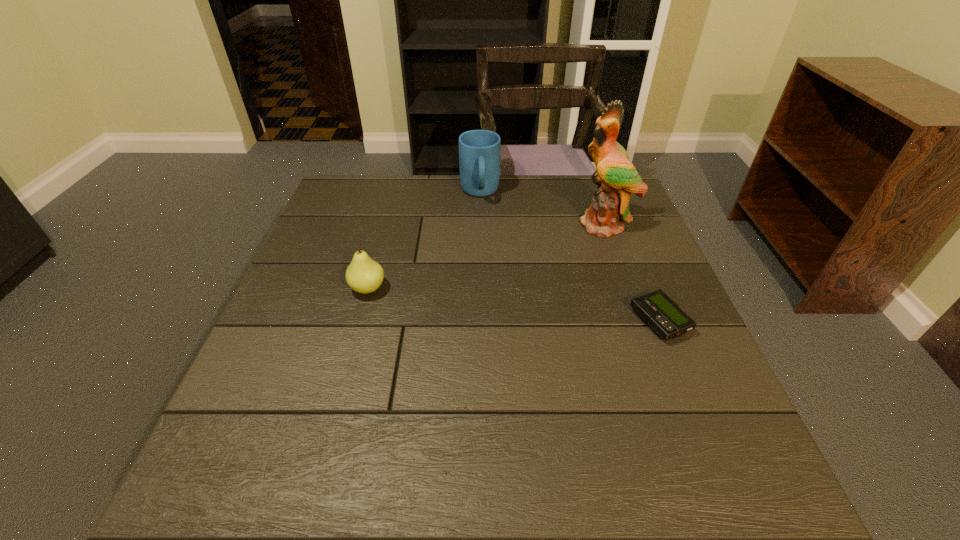
Where is `object situated at the far right corner`? object situated at the far right corner is located at coordinates (616, 177).

This screenshot has height=540, width=960. In order to click on vacant space at the far edge of the desktop in this screenshot , I will do `click(402, 193)`.

In the image, there is a desktop. Where is `vacant region at the near edge`? vacant region at the near edge is located at coordinates (429, 431).

You are a GUI agent. You are given a task and a screenshot of the screen. Output one action in this format:
    pyautogui.click(x=<x>, y=<y>)
    Task: Click on the blank space at the left edge of the desktop
    
    Given the screenshot: What is the action you would take?
    pyautogui.click(x=331, y=301)

This screenshot has height=540, width=960. Identify the location of free region at the right edge of the desktop. (599, 241).

What are the coordinates of `vacant space at the near right corner of the desktop` in the screenshot? It's located at (655, 421).

The image size is (960, 540). I want to click on free area in between the tallest object and the third tallest object, so click(x=487, y=256).

Locate an element on the screen. The width and height of the screenshot is (960, 540). unoccupied area between the second tallest object and the shortest object is located at coordinates (569, 257).

You are a GUI agent. You are given a task and a screenshot of the screen. Output one action in this format:
    pyautogui.click(x=<x>, y=<y>)
    Task: Click on the free spot between the parrot and the shortest object
    This screenshot has width=960, height=540.
    Given the screenshot: What is the action you would take?
    pyautogui.click(x=633, y=273)

Identify the location of vacant area between the third tallest object and the shortest object. The width and height of the screenshot is (960, 540). (514, 305).